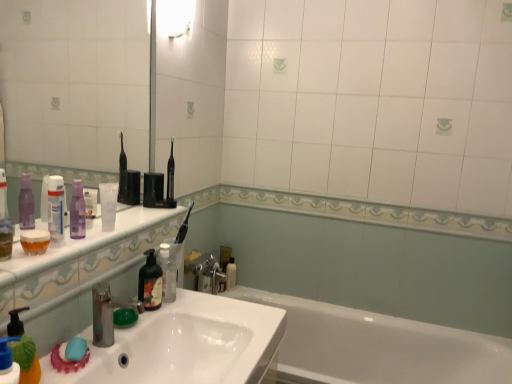
At what (x,y) coordinates should I click in order to perform the action: click on spots to the right of purple matte bottle at left, the fourth toiletry positioned from the bottom. Please return your answer as a coordinate pair (x, y). This screenshot has width=512, height=384. Looking at the image, I should click on (100, 240).